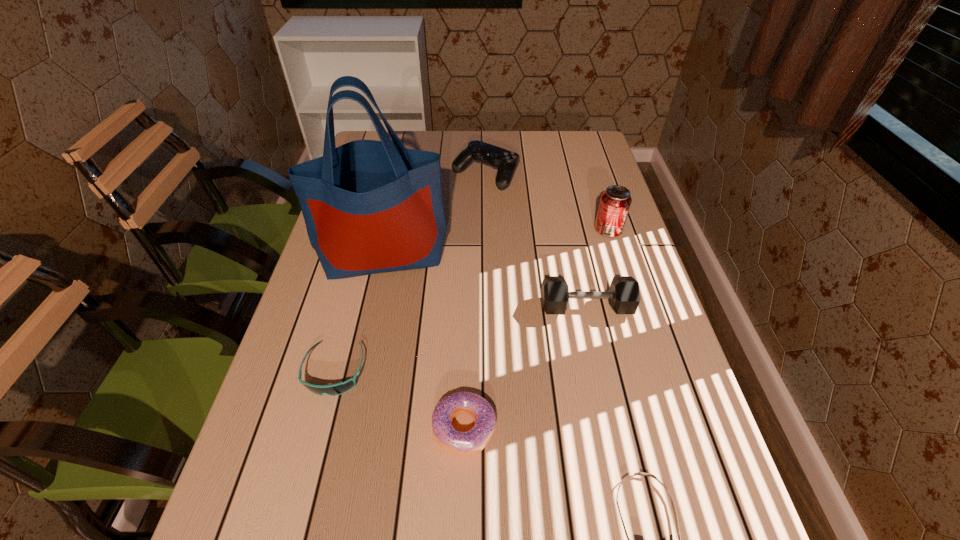
This screenshot has width=960, height=540. Identify the location of the tallest object. (369, 206).

The width and height of the screenshot is (960, 540). Find the location of `the second tallest object`. the second tallest object is located at coordinates (615, 202).

Where is `control`? Image resolution: width=960 pixels, height=540 pixels. control is located at coordinates (506, 161).

Find the location of a particular element. The width and height of the screenshot is (960, 540). dumbbell is located at coordinates (624, 297).

You are a GUI agent. You are given a task and a screenshot of the screen. Output one action in this format:
    pyautogui.click(x=<x>, y=<y>)
    Task: Click on the second nearest object
    
    Given the screenshot: What is the action you would take?
    pyautogui.click(x=470, y=442)

This screenshot has height=540, width=960. What are the coordinates of `the third nearest object` in the screenshot? It's located at (335, 389).

In order to click on the second shortest object in this screenshot , I will do `click(335, 389)`.

Identify the location of free spot located 0.150m on the back of the handbag. The height and width of the screenshot is (540, 960). (397, 197).

Find the location of `vacant space located on the left of the soda can`. vacant space located on the left of the soda can is located at coordinates (526, 230).

At what (x,y) coordinates should I click in order to perform the action: click on vacant region located on the left of the farthest object. Please return your answer as a coordinate pair (x, y). This screenshot has height=540, width=960. Looking at the image, I should click on [x=408, y=174].